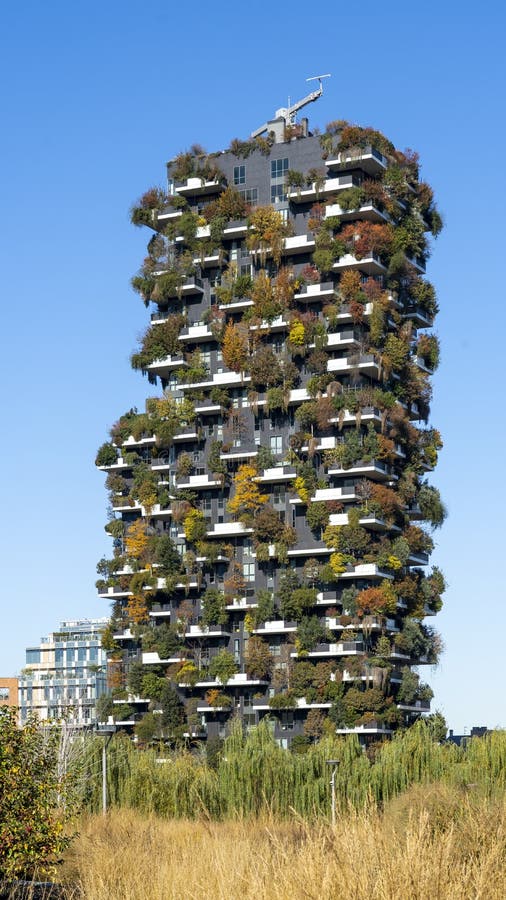
At what (x,y) coordinates should I click in order to perform the action: click on windows. Please return your answer as a coordinate pair (x, y). Looking at the image, I should click on (247, 579), (245, 703), (268, 652), (276, 446), (238, 176).